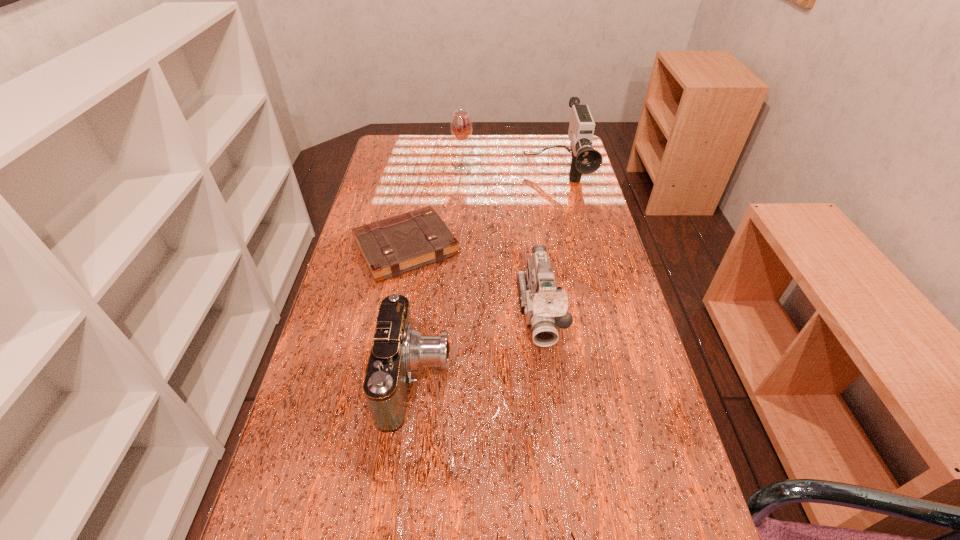
Identify the location of camcorder positioned at the left edge. (398, 349).

You are a GUI agent. You are given a task and a screenshot of the screen. Output one action in this format:
    pyautogui.click(x=<x>, y=<y>)
    Task: Click on the hardback book that is at the left edge
    The height and width of the screenshot is (540, 960).
    Given the screenshot: What is the action you would take?
    pyautogui.click(x=398, y=244)

The width and height of the screenshot is (960, 540). Find the location of `object at the right edge`. object at the right edge is located at coordinates (585, 159).

The width and height of the screenshot is (960, 540). What are the coordinates of `object positioned at the far right corner` in the screenshot? It's located at (585, 159).

The width and height of the screenshot is (960, 540). Identify the location of blank space at the far edge of the desktop. (533, 163).

Locate an element on the screen. vacant space at the left edge is located at coordinates (367, 286).

The height and width of the screenshot is (540, 960). Identify the location of free point at the right edge. (610, 478).

Where is `vacant area that lies between the second shortest object and the wineglass`? This screenshot has width=960, height=540. vacant area that lies between the second shortest object and the wineglass is located at coordinates coord(435,207).

Locate an element on the screen. The width and height of the screenshot is (960, 540). vacant space that's between the leftmost camcorder and the fifth tallest object is located at coordinates (411, 313).

Locate an element on the screen. This screenshot has height=540, width=960. free point between the leftmost camcorder and the fifth tallest object is located at coordinates (411, 313).